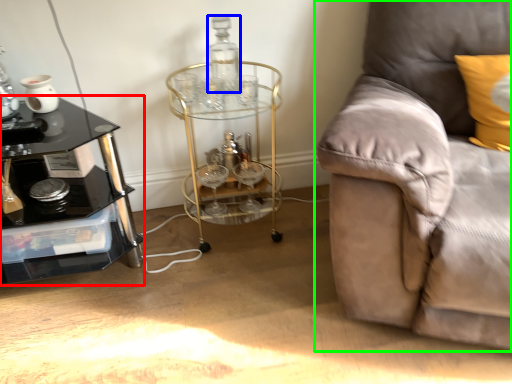
Question: Which object is the farthest from table (highlighted by a red box)? Choose among these: bottle (highlighted by a blue box) or studio couch (highlighted by a green box).

Choices:
 (A) bottle
 (B) studio couch

Answer: (B)